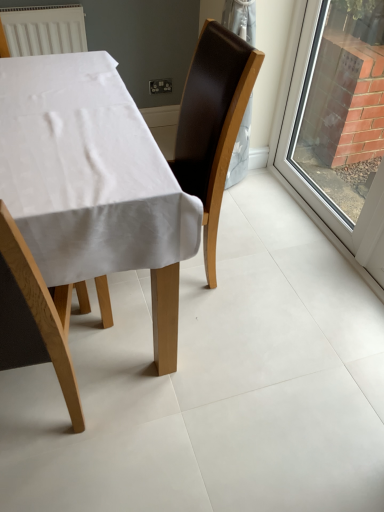
Question: Does brown leather chair at center, the first chair positioned from the back, appear on the left side of clear glass window at right?

Choices:
 (A) no
 (B) yes

Answer: (B)

Question: Can you confirm if brown leather chair at center, the 2th chair from the front, is shorter than clear glass window at right?

Choices:
 (A) yes
 (B) no

Answer: (A)

Question: Does brown leather chair at center, the first chair positioned from the back, have a greater height compared to clear glass window at right?

Choices:
 (A) yes
 (B) no

Answer: (B)

Question: Does brown leather chair at center, the 2th chair from the front, have a lesser width compared to clear glass window at right?

Choices:
 (A) yes
 (B) no

Answer: (B)

Question: Considering the relative positions of brown leather chair at center, the first chair positioned from the back, and clear glass window at right in the image provided, is brown leather chair at center, the first chair positioned from the back, to the right of clear glass window at right from the viewer's perspective?

Choices:
 (A) yes
 (B) no

Answer: (B)

Question: In the image, is brown leather chair at center, the 2th chair from the front, positioned in front of or behind white fabric-covered table at center?

Choices:
 (A) front
 (B) behind

Answer: (B)

Question: Is point (215, 60) closer or farther from the camera than point (59, 185)?

Choices:
 (A) farther
 (B) closer

Answer: (A)

Question: From the image's perspective, relative to white fabric-covered table at center, is brown leather chair at center, the first chair positioned from the back, above or below?

Choices:
 (A) above
 (B) below

Answer: (A)

Question: Considering the relative positions of brown leather chair at center, the 2th chair from the front, and white fabric-covered table at center in the image provided, is brown leather chair at center, the 2th chair from the front, to the left or to the right of white fabric-covered table at center?

Choices:
 (A) left
 (B) right

Answer: (B)

Question: From a real-world perspective, is white fabric-covered table at center positioned above or below brown leather chair at center, the 2th chair from the front?

Choices:
 (A) below
 (B) above

Answer: (A)

Question: Considering the relative positions of white fabric-covered table at center and brown leather chair at center, the 2th chair from the front, in the image provided, is white fabric-covered table at center to the left or to the right of brown leather chair at center, the 2th chair from the front,?

Choices:
 (A) left
 (B) right

Answer: (A)

Question: Relative to brown leather chair at center, the 2th chair from the front, is white fabric-covered table at center in front or behind?

Choices:
 (A) front
 (B) behind

Answer: (A)

Question: Is point (120, 120) closer or farther from the camera than point (206, 77)?

Choices:
 (A) closer
 (B) farther

Answer: (A)

Question: In terms of height, does wooden chair at lower left, the first chair viewed from the front, look taller or shorter compared to white fabric-covered table at center?

Choices:
 (A) tall
 (B) short

Answer: (A)

Question: Looking at the image, does wooden chair at lower left, which is counted as the second chair, starting from the back, seem bigger or smaller compared to white fabric-covered table at center?

Choices:
 (A) small
 (B) big

Answer: (A)